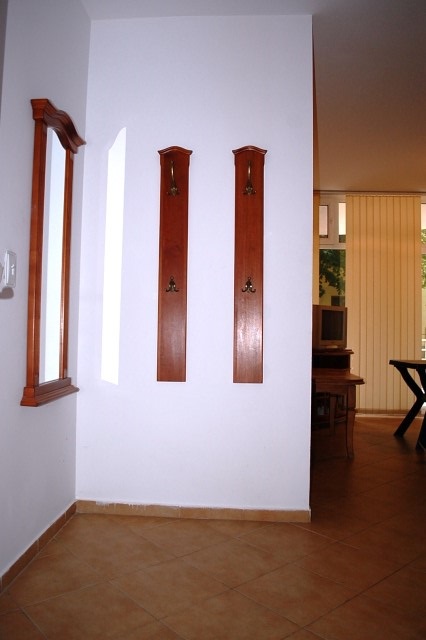
In order to click on switch in this screenshot , I will do `click(14, 272)`.